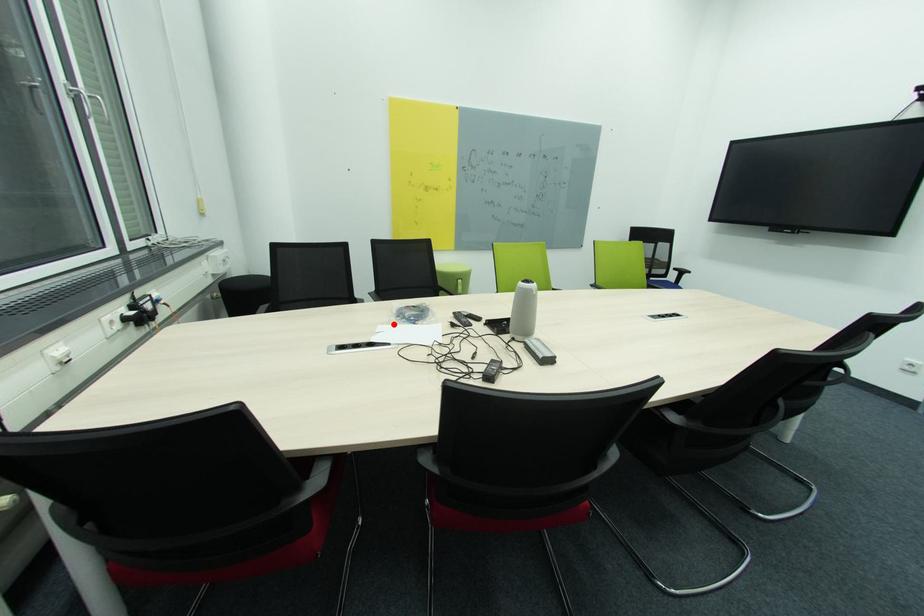
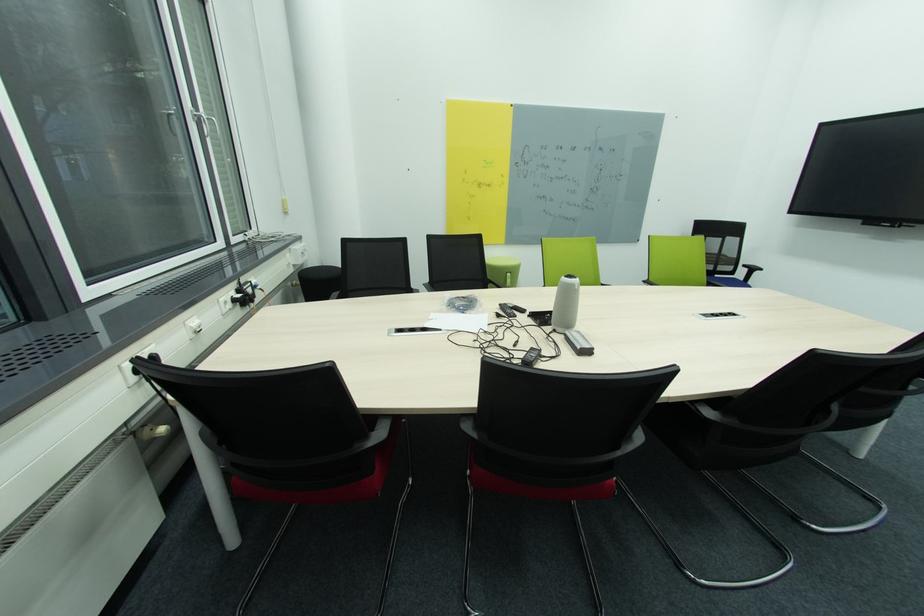
Locate, in the second image, the point that corresponds to the highlighted location in the first image.

(444, 313)